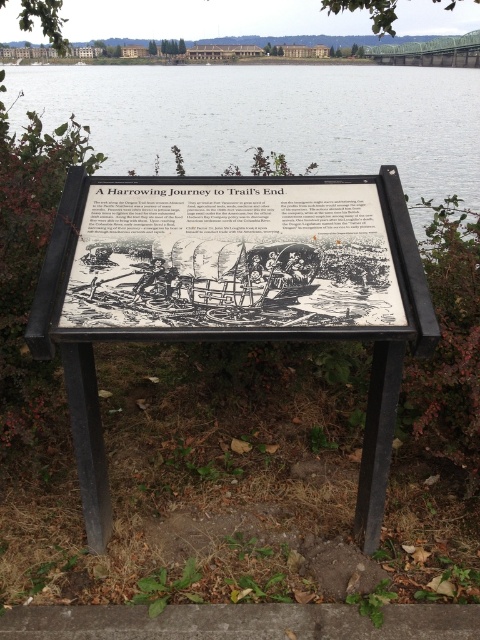
Question: Is black wood sign at center positioned in front of transparent water at center?

Choices:
 (A) yes
 (B) no

Answer: (A)

Question: Is black wood sign at center above transparent water at center?

Choices:
 (A) yes
 (B) no

Answer: (B)

Question: Can you confirm if black wood sign at center is positioned below transparent water at center?

Choices:
 (A) yes
 (B) no

Answer: (A)

Question: Which object is closer to the camera taking this photo?

Choices:
 (A) transparent water at center
 (B) black wood sign at center

Answer: (B)

Question: Among these points, which one is farthest from the camera?

Choices:
 (A) (287, 188)
 (B) (304, 116)

Answer: (B)